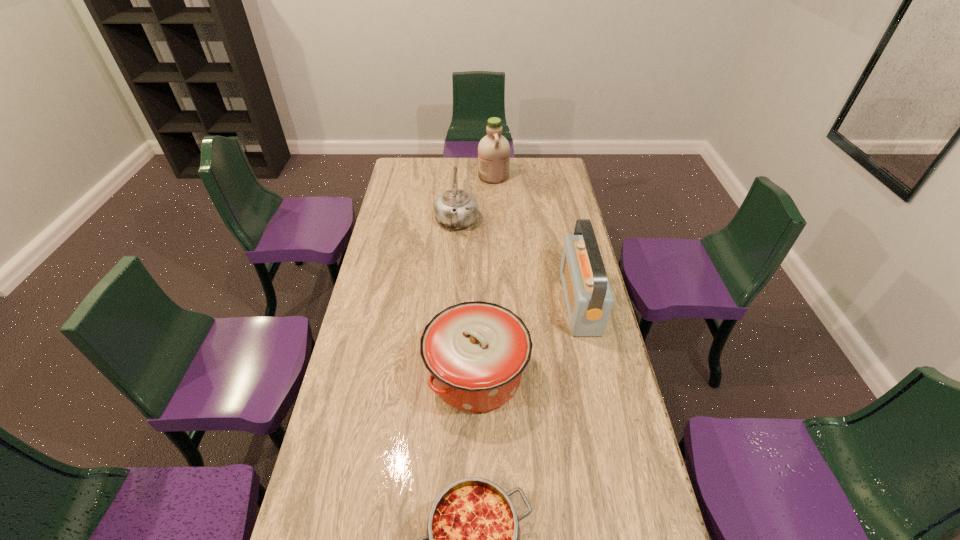
The image size is (960, 540). Find the location of `the farthest object`. the farthest object is located at coordinates (493, 150).

The height and width of the screenshot is (540, 960). I want to click on radio receiver, so click(588, 296).

The width and height of the screenshot is (960, 540). Find the location of `kettle`. kettle is located at coordinates (456, 209).

Locate an element on the screen. the taller casserole is located at coordinates (475, 352).

The image size is (960, 540). In order to click on vacant space located 0.300m on the front label of the cleansing agent in this screenshot , I will do `click(420, 176)`.

Image resolution: width=960 pixels, height=540 pixels. Identify the location of vacant space located 0.210m on the front label of the cleansing agent. (438, 176).

Find the location of `vacant space located 0.060m on the front label of the cleansing agent`. vacant space located 0.060m on the front label of the cleansing agent is located at coordinates (467, 176).

The height and width of the screenshot is (540, 960). Identify the location of vacant space located on the front-facing side of the radio receiver. (492, 302).

Where is `free space located on the front-facing side of the radio receiver`? The width and height of the screenshot is (960, 540). free space located on the front-facing side of the radio receiver is located at coordinates (533, 302).

Where is `vacant space positioned 0.400m on the front-facing side of the radio receiver`? vacant space positioned 0.400m on the front-facing side of the radio receiver is located at coordinates (458, 302).